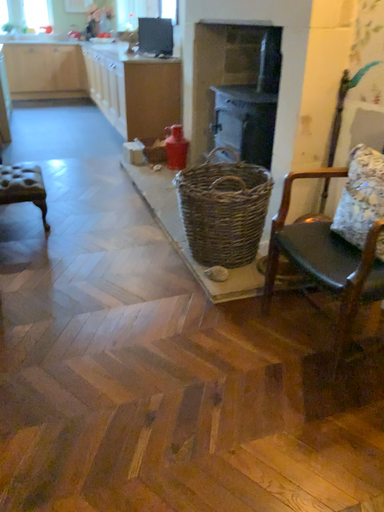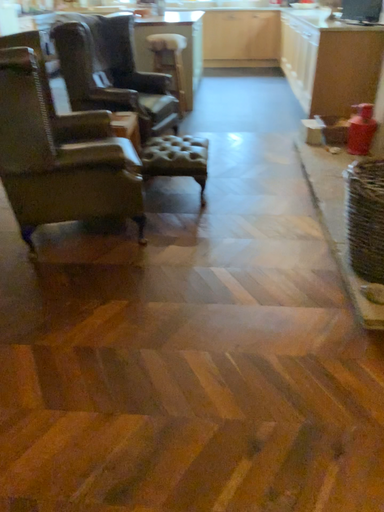
Question: How did the camera likely rotate when shooting the video?

Choices:
 (A) rotated right
 (B) rotated left

Answer: (B)